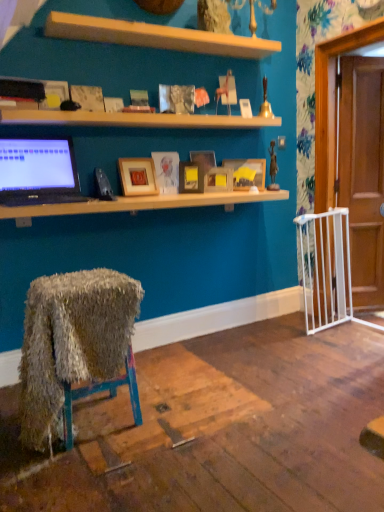
In order to face matte wooden picture frame at center, the sixth picture frame when ordered from left to right, should I rotate leftwards or rightwards?

To face it directly, rotate right by 6.939 degrees.

Find the location of `matte wooden picture frame at center, the first picture frame positioned from the right`. matte wooden picture frame at center, the first picture frame positioned from the right is located at coordinates (247, 173).

The image size is (384, 512). What do you see at coordinates (204, 159) in the screenshot? I see `matte wooden picture frame at center, the fourth picture frame positioned from the left` at bounding box center [204, 159].

Measure the distance between point (x=201, y=156) and camera.

Point (x=201, y=156) and camera are 10.11 feet apart from each other.

What is the approximate width of matte wooden picture frame at center, which is the second picture frame from left to right?

matte wooden picture frame at center, which is the second picture frame from left to right, is 3.23 inches in width.

Find the location of `matte wooden picture frame at center, which ranks as the second picture frame in right-to-left order`. matte wooden picture frame at center, which ranks as the second picture frame in right-to-left order is located at coordinates (218, 180).

How far apart are matte wooden picture frame at center, the first picture frame positioned from the right, and matte black laptop at left?

matte wooden picture frame at center, the first picture frame positioned from the right, and matte black laptop at left are 1.28 meters apart.

This screenshot has height=512, width=384. There is a matte black laptop at left. In order to click on the 3rd picture frame above it (from the image's perspective) in this screenshot , I will do `click(247, 173)`.

Considering the relative positions of matte wooden picture frame at center, the first picture frame positioned from the right, and matte black laptop at left in the image provided, is matte wooden picture frame at center, the first picture frame positioned from the right, to the right of matte black laptop at left from the viewer's perspective?

Indeed, matte wooden picture frame at center, the first picture frame positioned from the right, is positioned on the right side of matte black laptop at left.

Considering the relative sizes of matte wooden picture frame at center, the first picture frame positioned from the right, and matte black laptop at left in the image provided, is matte wooden picture frame at center, the first picture frame positioned from the right, wider than matte black laptop at left?

No.

Who is smaller, matte wooden picture frame at center, the sixth picture frame when ordered from left to right, or white plastic gate at right?

matte wooden picture frame at center, the sixth picture frame when ordered from left to right.

Which object is closer to the camera, matte wooden picture frame at center, the first picture frame positioned from the right, or white plastic gate at right?

matte wooden picture frame at center, the first picture frame positioned from the right.

Is matte wooden picture frame at center, the sixth picture frame when ordered from left to right, at the left side of white plastic gate at right?

Indeed, matte wooden picture frame at center, the sixth picture frame when ordered from left to right, is positioned on the left side of white plastic gate at right.

How many degrees apart are the facing directions of matte wooden picture frame at center, the first picture frame positioned from the right, and white plastic gate at right?

The angle between the facing direction of matte wooden picture frame at center, the first picture frame positioned from the right, and the facing direction of white plastic gate at right is 17.6 degrees.

Is wooden shelf at upper center, which is counted as the first shelf, starting from the bottom, taller than white plastic gate at right?

No, wooden shelf at upper center, which is counted as the first shelf, starting from the bottom, is not taller than white plastic gate at right.

Could you tell me if wooden shelf at upper center, which is counted as the first shelf, starting from the bottom, is facing white plastic gate at right?

No.

Is wooden shelf at upper center, which is counted as the first shelf, starting from the bottom, not near white plastic gate at right?

Absolutely, wooden shelf at upper center, which is counted as the first shelf, starting from the bottom, is distant from white plastic gate at right.

The width and height of the screenshot is (384, 512). What are the coordinates of `shelf that is the 2nd object located in front of the white plastic gate at right` in the screenshot? It's located at (134, 119).

Could you measure the distance between matte black desk at upper center, positioned as the 1th desk in top-to-bottom order, and fuzzy fabric chair at lower left, which is counted as the 1th desk, starting from the bottom?

matte black desk at upper center, positioned as the 1th desk in top-to-bottom order, and fuzzy fabric chair at lower left, which is counted as the 1th desk, starting from the bottom, are 82.34 centimeters apart.

Considering the sizes of objects matte black desk at upper center, marked as the second desk in a bottom-to-top arrangement, and fuzzy fabric chair at lower left, which is the 2th desk in top-to-bottom order, in the image provided, who is thinner, matte black desk at upper center, marked as the second desk in a bottom-to-top arrangement, or fuzzy fabric chair at lower left, which is the 2th desk in top-to-bottom order,?

With smaller width is matte black desk at upper center, marked as the second desk in a bottom-to-top arrangement.

From a real-world perspective, between matte black desk at upper center, marked as the second desk in a bottom-to-top arrangement, and fuzzy fabric chair at lower left, which is the 2th desk in top-to-bottom order, who is vertically higher?

matte black desk at upper center, marked as the second desk in a bottom-to-top arrangement.

How many degrees apart are the facing directions of matte black desk at upper center, positioned as the 1th desk in top-to-bottom order, and fuzzy fabric chair at lower left, which is the 2th desk in top-to-bottom order?

The angular difference between matte black desk at upper center, positioned as the 1th desk in top-to-bottom order, and fuzzy fabric chair at lower left, which is the 2th desk in top-to-bottom order, is 0.603 degrees.

From a real-world perspective, does matte black desk at upper center, positioned as the 1th desk in top-to-bottom order, stand above wooden picture frame at center, the 6th picture frame from the right?

No.

Which is in front, point (134, 209) or point (118, 159)?

Point (134, 209)

Considering the relative sizes of matte black desk at upper center, positioned as the 1th desk in top-to-bottom order, and wooden picture frame at center, which is the 1th picture frame from left to right, in the image provided, is matte black desk at upper center, positioned as the 1th desk in top-to-bottom order, wider than wooden picture frame at center, which is the 1th picture frame from left to right,?

Correct, the width of matte black desk at upper center, positioned as the 1th desk in top-to-bottom order, exceeds that of wooden picture frame at center, which is the 1th picture frame from left to right.

From the image's perspective, which one is positioned higher, matte black desk at upper center, marked as the second desk in a bottom-to-top arrangement, or wooden picture frame at center, which is the 1th picture frame from left to right?

wooden picture frame at center, which is the 1th picture frame from left to right, from the image's perspective.

Can you confirm if matte black desk at upper center, positioned as the 1th desk in top-to-bottom order, is positioned to the right of wooden shelf at upper center, which appears as the second shelf when viewed from the top?

Indeed, matte black desk at upper center, positioned as the 1th desk in top-to-bottom order, is positioned on the right side of wooden shelf at upper center, which appears as the second shelf when viewed from the top.

Which object is more forward, matte black desk at upper center, positioned as the 1th desk in top-to-bottom order, or wooden shelf at upper center, which appears as the second shelf when viewed from the top?

matte black desk at upper center, positioned as the 1th desk in top-to-bottom order, is in front.

Do you think matte black desk at upper center, marked as the second desk in a bottom-to-top arrangement, is within wooden shelf at upper center, which is counted as the first shelf, starting from the bottom, or outside of it?

matte black desk at upper center, marked as the second desk in a bottom-to-top arrangement, is outside wooden shelf at upper center, which is counted as the first shelf, starting from the bottom.

Is wooden shelf at upper center, which appears as the second shelf when viewed from the top, with matte black desk at upper center, marked as the second desk in a bottom-to-top arrangement?

wooden shelf at upper center, which appears as the second shelf when viewed from the top, is not next to matte black desk at upper center, marked as the second desk in a bottom-to-top arrangement, and they're not touching.

Is wooden shelf at upper center, which is counted as the first shelf, starting from the bottom, turned away from matte black desk at upper center, positioned as the 1th desk in top-to-bottom order?

No, wooden shelf at upper center, which is counted as the first shelf, starting from the bottom,'s orientation is not away from matte black desk at upper center, positioned as the 1th desk in top-to-bottom order.

Can you confirm if wooden shelf at upper center, which is counted as the first shelf, starting from the bottom, is taller than matte black desk at upper center, positioned as the 1th desk in top-to-bottom order?

No.

Where is `shelf on the left of matte black desk at upper center, marked as the second desk in a bottom-to-top arrangement`? shelf on the left of matte black desk at upper center, marked as the second desk in a bottom-to-top arrangement is located at coordinates (134, 119).

From the image's perspective, count 3rd picture frames upward from the matte black laptop at left and point to it. Please provide its 2D coordinates.

[(247, 173)]

Find the location of a particular element. screen door on the right side of matte wooden picture frame at center, the sixth picture frame when ordered from left to right is located at coordinates (363, 174).

Which object lies further to the anchor point white plastic gate at right, matte wooden picture frame at center, which is the second picture frame from left to right, or wooden shelf at upper center, which is counted as the first shelf, starting from the bottom?

matte wooden picture frame at center, which is the second picture frame from left to right, lies further to white plastic gate at right than the other object.

Looking at the image, which one is located further to matte wooden picture frame at center, the sixth picture frame when ordered from left to right, matte wooden picture frame at center, which appears as the fifth picture frame when viewed from the right, or white plastic gate at right?

Based on the image, white plastic gate at right appears to be further to matte wooden picture frame at center, the sixth picture frame when ordered from left to right.

Based on the photo, from the image, which object appears to be farther from wooden shelf at upper center, which is counted as the first shelf, starting from the bottom, matte black desk at upper center, positioned as the 1th desk in top-to-bottom order, or wooden at upper center, acting as the 1th shelf starting from the top?

matte black desk at upper center, positioned as the 1th desk in top-to-bottom order, is positioned further to the anchor wooden shelf at upper center, which is counted as the first shelf, starting from the bottom.

Based on their spatial positions, is fuzzy fabric chair at lower left, which is counted as the 1th desk, starting from the bottom, or white plastic gate at right further from matte wooden picture frame at center, which ranks as the second picture frame in right-to-left order?

fuzzy fabric chair at lower left, which is counted as the 1th desk, starting from the bottom.

Looking at the image, which one is located closer to matte wooden picture frame at center, the first picture frame positioned from the right, matte gold picture frame at center, the 3th picture frame when ordered from left to right, or wooden shelf at upper center, which is counted as the first shelf, starting from the bottom?

Among the two, matte gold picture frame at center, the 3th picture frame when ordered from left to right, is located nearer to matte wooden picture frame at center, the first picture frame positioned from the right.

Looking at the image, which one is located further to wooden picture frame at center, which is the 1th picture frame from left to right, matte wooden picture frame at center, which is the second picture frame from left to right, or wooden at upper center, which is the 2th shelf from bottom to top?

Based on the image, wooden at upper center, which is the 2th shelf from bottom to top, appears to be further to wooden picture frame at center, which is the 1th picture frame from left to right.

In the scene shown: Based on their spatial positions, is wooden at upper center, which is the 2th shelf from bottom to top, or fuzzy fabric chair at lower left, which is counted as the 1th desk, starting from the bottom, further from matte black desk at upper center, positioned as the 1th desk in top-to-bottom order?

Among the two, wooden at upper center, which is the 2th shelf from bottom to top, is located further to matte black desk at upper center, positioned as the 1th desk in top-to-bottom order.

Looking at the image, which one is located further to matte black laptop at left, matte black desk at upper center, marked as the second desk in a bottom-to-top arrangement, or matte wooden picture frame at center, the fourth picture frame positioned from the left?

matte wooden picture frame at center, the fourth picture frame positioned from the left, is further to matte black laptop at left.

This screenshot has height=512, width=384. In order to click on desk located between wooden shelf at upper center, which is counted as the first shelf, starting from the bottom, and white plastic gate at right in the left-right direction in this screenshot , I will do `click(143, 203)`.

Locate an element on the screen. shelf between wooden at upper center, which is the 2th shelf from bottom to top, and fuzzy fabric chair at lower left, which is the 2th desk in top-to-bottom order, vertically is located at coordinates (134, 119).

Find the location of a particular element. picture frame situated between matte wooden picture frame at center, placed as the fifth picture frame when sorted from left to right, and white plastic gate at right from left to right is located at coordinates tap(247, 173).

Image resolution: width=384 pixels, height=512 pixels. In order to click on picture frame situated between matte black laptop at left and wooden shelf at upper center, which is counted as the first shelf, starting from the bottom, from left to right in this screenshot , I will do `click(137, 176)`.